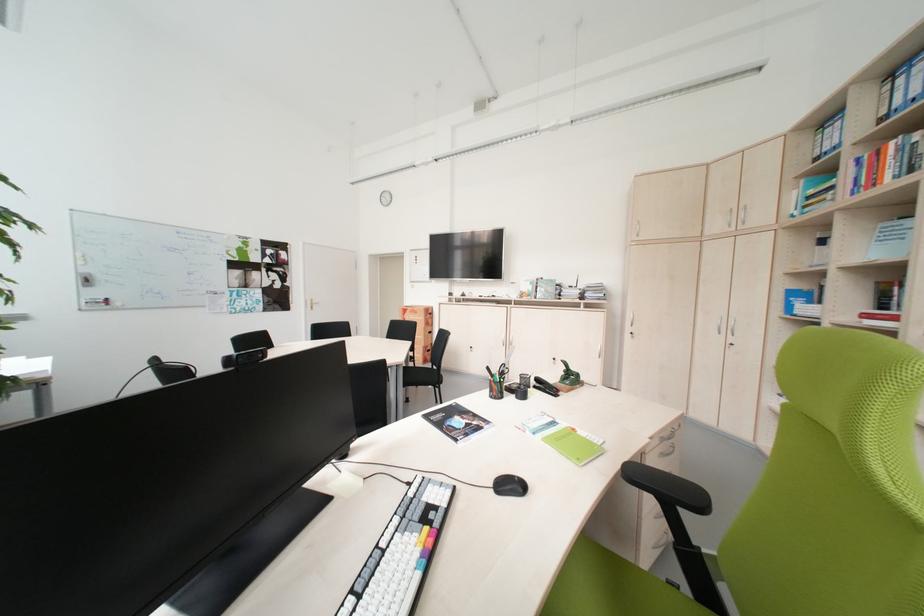
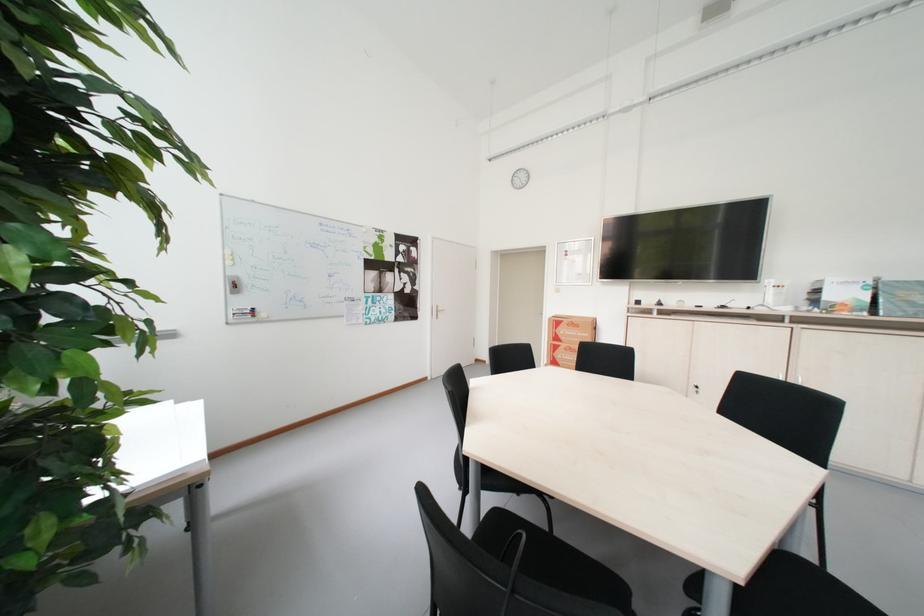
The images are taken continuously from a first-person perspective. In which direction are you moving?

The cameraman moved toward left, forward.